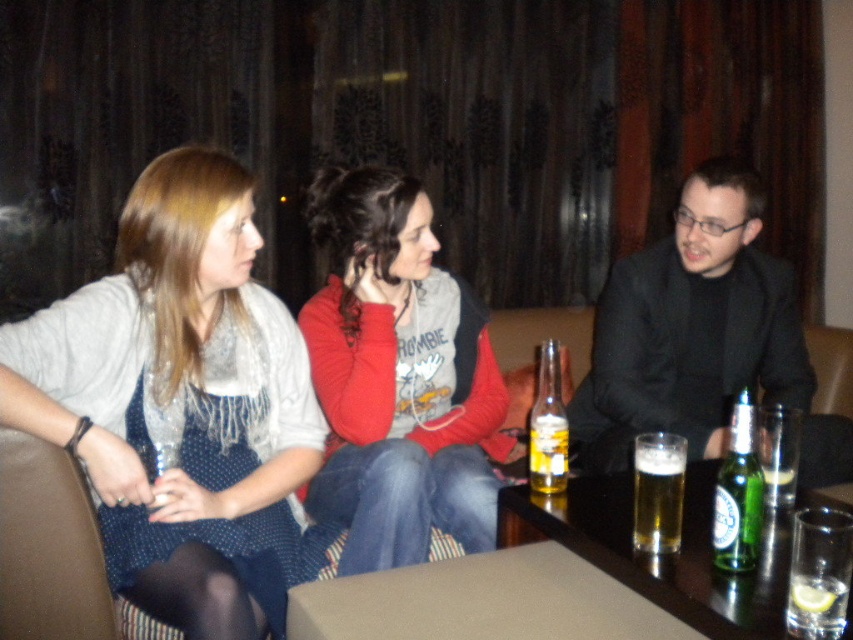
You are at a bar and need to place your drink on the shiny dark wood table at lower center. However, there is a green glass bottle at center in the way. Which object should you move to make space?

The green glass bottle at center is on the right side of the shiny dark wood table at lower center. To make space, you should move the green glass bottle at center to the right.

You are a person who wants to place a small book on the shiny dark wood table at lower center so that it won t fall off. Considering the green glass bottle at center is already there, where should you place the book?

The shiny dark wood table at lower center is much taller than the green glass bottle at center, so placing the book on the table next to the green glass bottle at center would keep it stable and prevent it from falling off.

You are at the social gathering and want to grab a drink. There is a green glass bottle at lower right. Can you reach it from your current position at point (738, 493)?

The green glass bottle at lower right is located at point (738, 493), so you are already at its position and can reach it.